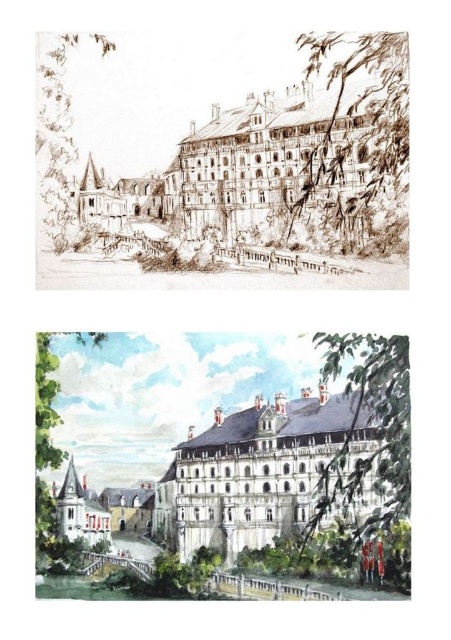
Question: Is the position of white paper building at center less distant than that of white stone palace at center?

Choices:
 (A) yes
 (B) no

Answer: (A)

Question: Which point is closer to the camera taking this photo?

Choices:
 (A) [147, 540]
 (B) [307, 394]

Answer: (B)

Question: Does white paper building at center lie in front of white stone palace at center?

Choices:
 (A) no
 (B) yes

Answer: (B)

Question: Which point appears farthest from the camera in this image?

Choices:
 (A) (161, 541)
 (B) (304, 500)

Answer: (A)

Question: Does white paper building at center appear under white stone palace at center?

Choices:
 (A) yes
 (B) no

Answer: (B)